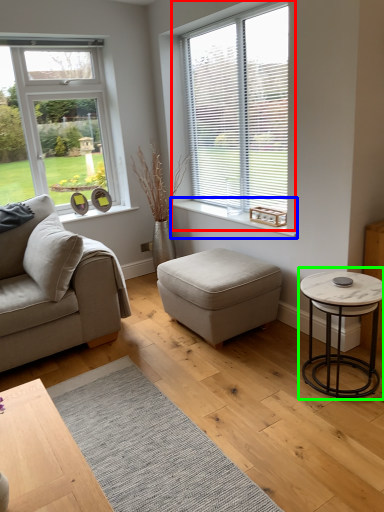
Question: Considering the real-world distances, which object is farthest from window (highlighted by a red box)? window sill (highlighted by a blue box) or coffee table (highlighted by a green box)?

Choices:
 (A) window sill
 (B) coffee table

Answer: (B)